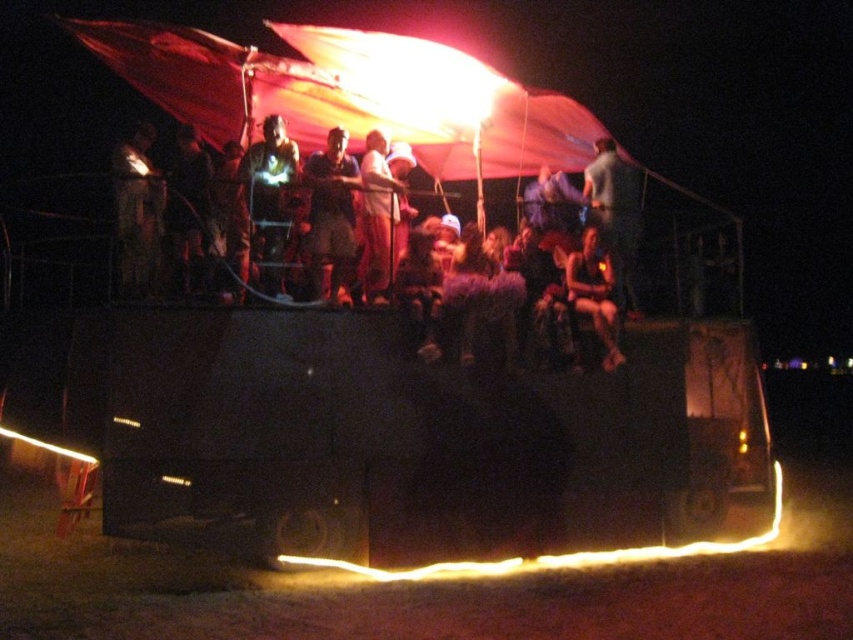
Can you confirm if translucent fabric canopy at upper center is positioned below metallic silver helmet at center?

Actually, translucent fabric canopy at upper center is above metallic silver helmet at center.

Identify the location of translucent fabric canopy at upper center. This screenshot has width=853, height=640. (350, 93).

You are a GUI agent. You are given a task and a screenshot of the screen. Output one action in this format:
    pyautogui.click(x=<x>, y=<y>)
    Task: Click on the translucent fabric canopy at upper center
    The image size is (853, 640).
    Given the screenshot: What is the action you would take?
    pyautogui.click(x=350, y=93)

Between matte black shirt at center and dark gray fabric at upper right, which one has less height?

With less height is matte black shirt at center.

I want to click on matte black shirt at center, so click(x=329, y=216).

Locate an element on the screen. The height and width of the screenshot is (640, 853). matte black shirt at center is located at coordinates (329, 216).

Who is positioned more to the left, translucent fabric canopy at upper center or matte black shirt at center?

From the viewer's perspective, matte black shirt at center appears more on the left side.

Who is lower down, translucent fabric canopy at upper center or matte black shirt at center?

matte black shirt at center is below.

The image size is (853, 640). Identify the location of translucent fabric canopy at upper center. point(350,93).

Where is `translucent fabric canopy at upper center`? Image resolution: width=853 pixels, height=640 pixels. translucent fabric canopy at upper center is located at coordinates (350, 93).